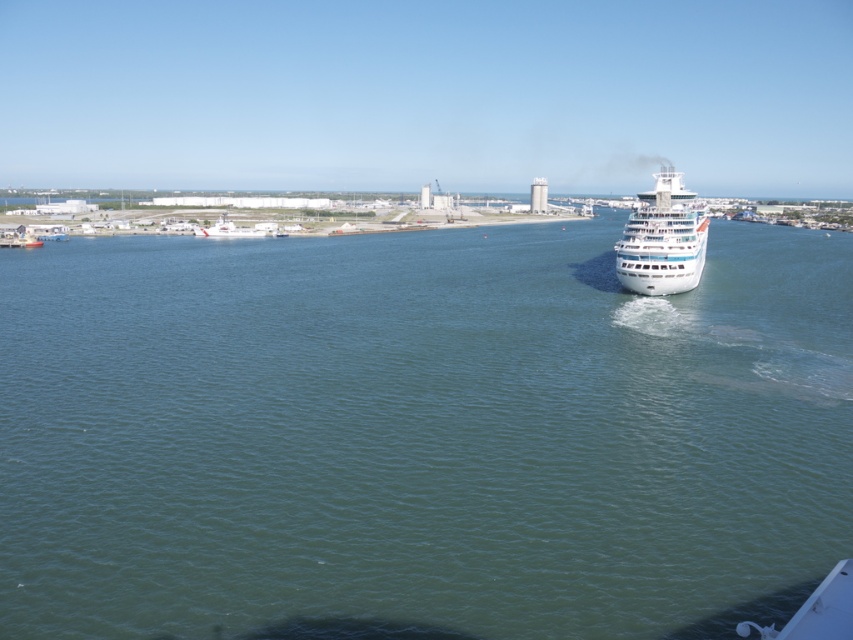
Question: Can you confirm if green water at center is positioned above white glossy cruise ship at center?

Choices:
 (A) yes
 (B) no

Answer: (B)

Question: Can you confirm if green water at center is wider than white glossy cruise ship at center?

Choices:
 (A) yes
 (B) no

Answer: (A)

Question: Which point appears closest to the camera in this image?

Choices:
 (A) (572, 536)
 (B) (628, 236)

Answer: (A)

Question: Among these objects, which one is nearest to the camera?

Choices:
 (A) white glossy cruise ship at center
 (B) green water at center

Answer: (B)

Question: Does green water at center appear on the left side of white glossy cruise ship at center?

Choices:
 (A) no
 (B) yes

Answer: (B)